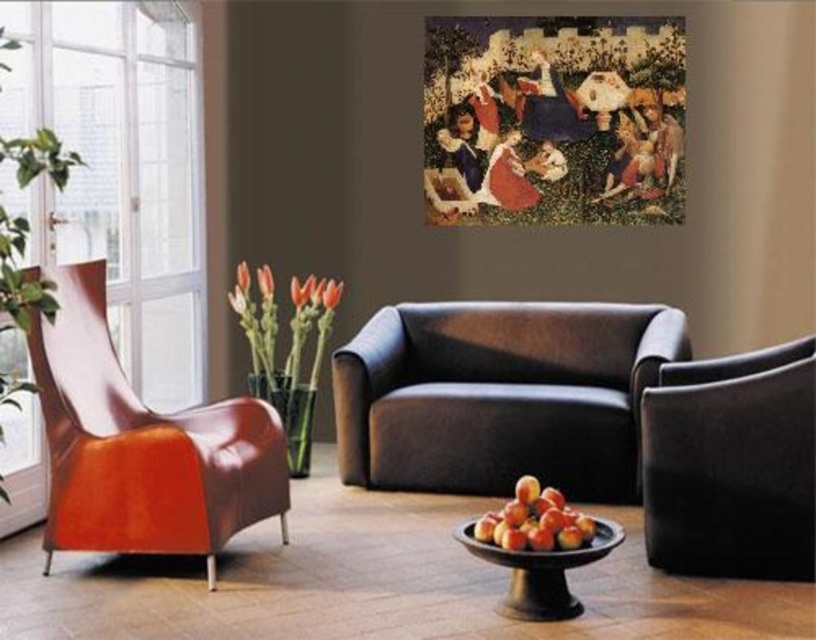
Is dark brown leather couch at center wider than black fabric armchair at right?

Indeed, dark brown leather couch at center has a greater width compared to black fabric armchair at right.

Where is `dark brown leather couch at center`? The image size is (816, 640). dark brown leather couch at center is located at coordinates (500, 396).

Is point (604, 406) positioned in front of point (766, 552)?

No, it is behind (766, 552).

Where is `dark brown leather couch at center`? This screenshot has width=816, height=640. dark brown leather couch at center is located at coordinates (500, 396).

Does dark brown leather couch at center have a larger size compared to glossy wooden bowl of peaches at lower center?

Indeed, dark brown leather couch at center has a larger size compared to glossy wooden bowl of peaches at lower center.

From the picture: Which is above, dark brown leather couch at center or glossy wooden bowl of peaches at lower center?

dark brown leather couch at center

The width and height of the screenshot is (816, 640). In order to click on dark brown leather couch at center in this screenshot , I will do `click(500, 396)`.

Locate an element on the screen. This screenshot has height=640, width=816. dark brown leather couch at center is located at coordinates (500, 396).

Is point (191, 436) less distant than point (540, 497)?

No, (191, 436) is behind (540, 497).

Between glossy leather armchair at left and glossy wooden bowl of peaches at lower center, which one has less height?

glossy wooden bowl of peaches at lower center is shorter.

Between point (96, 474) and point (544, 500), which one is positioned behind?

The point (96, 474) is behind.

This screenshot has height=640, width=816. I want to click on glossy leather armchair at left, so click(142, 445).